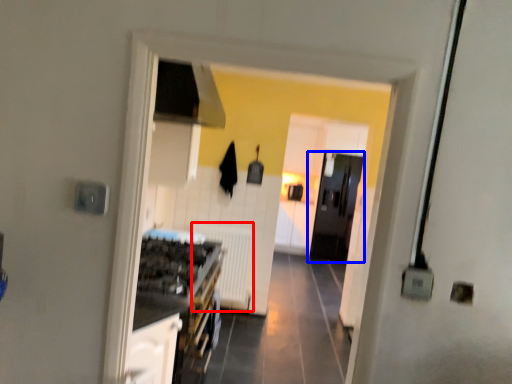
Question: Which point is closer to the camera, radiator (highlighted by a red box) or door (highlighted by a blue box)?

Choices:
 (A) radiator
 (B) door

Answer: (A)